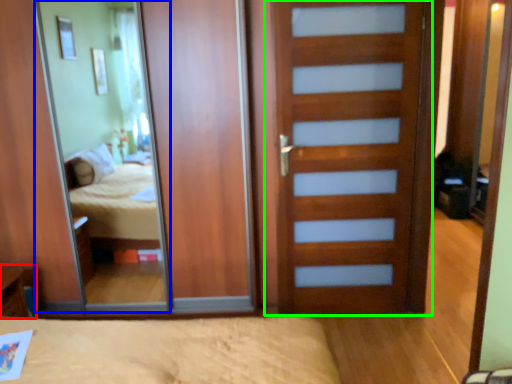
Question: Which object is positioned farthest from table (highlighted by a red box)? Select from mirror (highlighted by a blue box) and door (highlighted by a green box).

Choices:
 (A) mirror
 (B) door

Answer: (B)